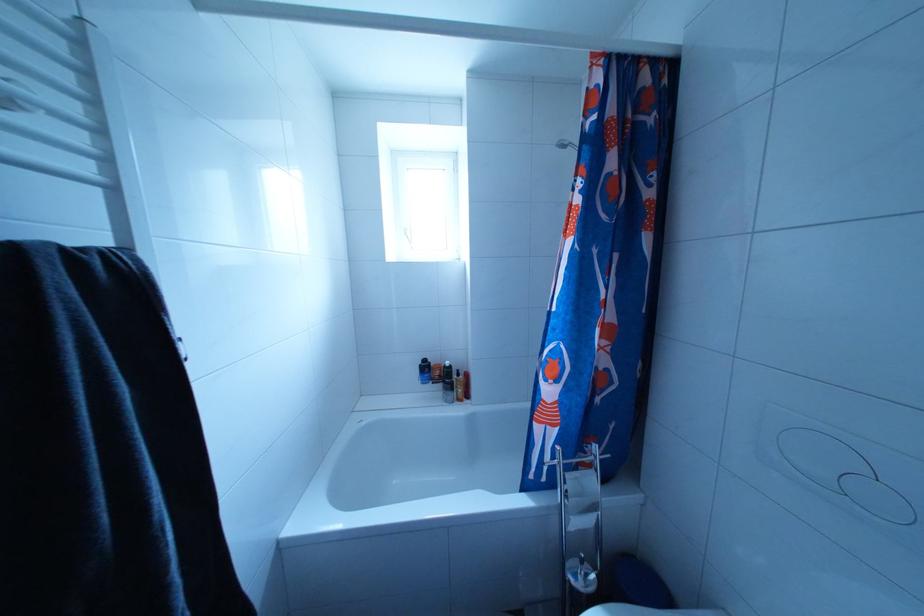
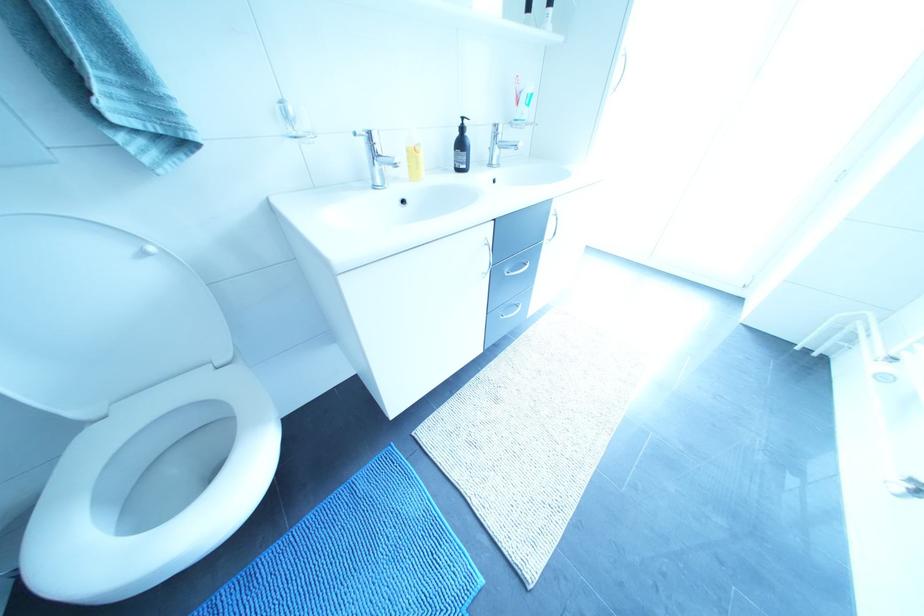
Question: I am providing you with two images of the same scene from different viewpoints. After the viewpoint changes to image2, which objects are now occluded?

Choices:
 (A) clear wall-mounted cup
 (B) silver drawer handle
 (C) black pump-top bottle
 (D) orange stress ball

Answer: (C)